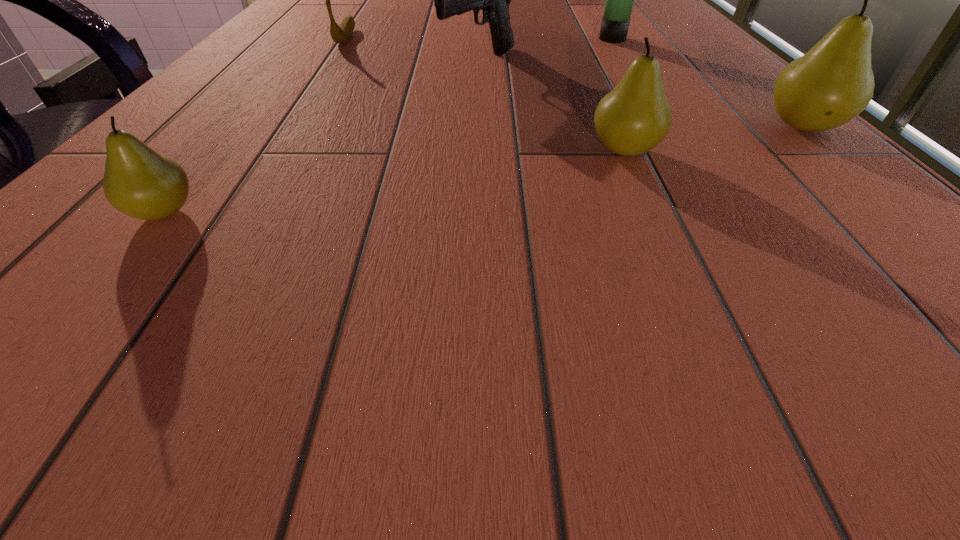
The image size is (960, 540). I want to click on pear present at the right edge, so click(x=831, y=84).

Where is `thermos bottle that is at the right edge`? thermos bottle that is at the right edge is located at coordinates (615, 23).

Where is `object present at the near left corner`? object present at the near left corner is located at coordinates (138, 181).

Image resolution: width=960 pixels, height=540 pixels. In the image, there is a desktop. In order to click on blank space at the near edge in this screenshot , I will do `click(425, 244)`.

In the image, there is a desktop. Identify the location of blank space at the left edge. This screenshot has width=960, height=540. (319, 10).

This screenshot has width=960, height=540. In order to click on vacant space at the right edge of the desktop in this screenshot , I will do `click(833, 192)`.

Locate an element on the screen. free region at the near left corner is located at coordinates (55, 251).

Locate an element on the screen. This screenshot has width=960, height=540. vacant space that is in between the leftmost pear and the second object from right to left is located at coordinates (389, 126).

At what (x,y) coordinates should I click in order to perform the action: click on vacant space that is in between the nearest pear and the thermos bottle. Please return your answer as a coordinate pair (x, y). The width and height of the screenshot is (960, 540). Looking at the image, I should click on (389, 126).

Where is `vacant area that lies between the leftmost pear and the gun`? vacant area that lies between the leftmost pear and the gun is located at coordinates (322, 138).